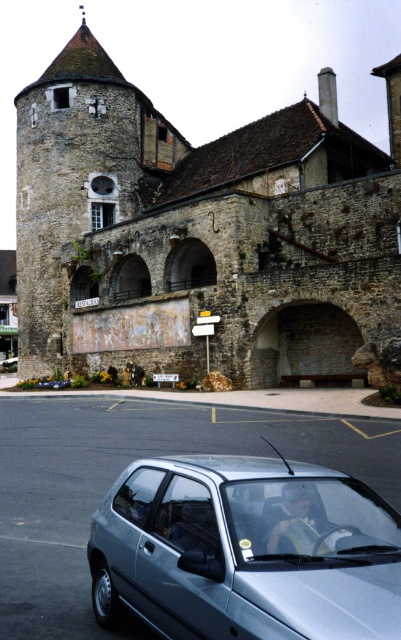
Question: Does stone tower at center have a greater width compared to satin silver car at lower center?

Choices:
 (A) yes
 (B) no

Answer: (A)

Question: Is stone tower at center above white plastic license plate at center?

Choices:
 (A) no
 (B) yes

Answer: (B)

Question: Which of these objects is positioned farthest from the white plastic license plate at center?

Choices:
 (A) satin silver car at lower center
 (B) stone tower at center

Answer: (A)

Question: Is stone tower at center behind white plastic license plate at center?

Choices:
 (A) no
 (B) yes

Answer: (A)

Question: Based on their relative distances, which object is farther from the satin silver car at lower center?

Choices:
 (A) white plastic license plate at center
 (B) stone tower at center

Answer: (B)

Question: Which object is closer to the camera taking this photo?

Choices:
 (A) satin silver car at lower center
 (B) white plastic license plate at center
 (C) stone tower at center

Answer: (A)